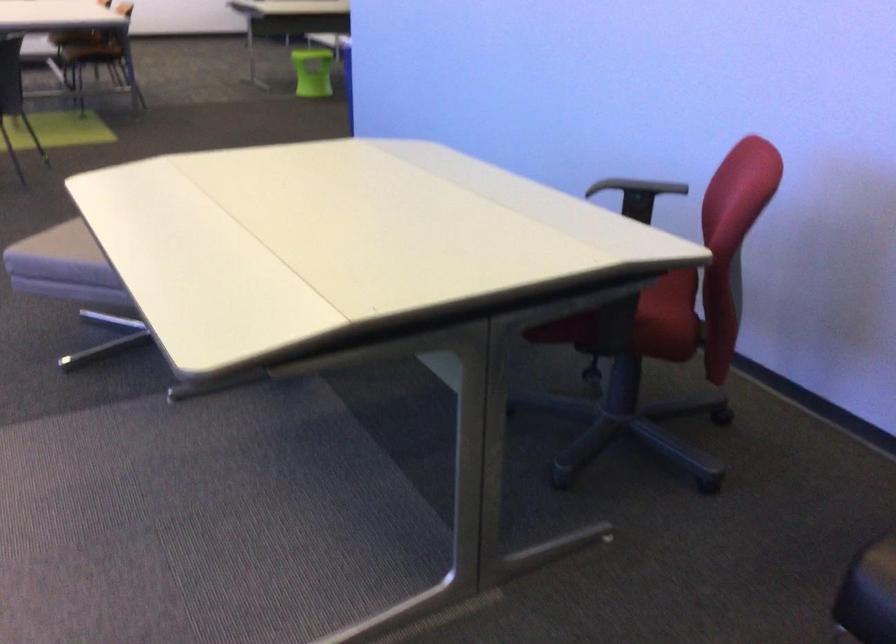
Locate an element on the screen. The image size is (896, 644). green plastic bin is located at coordinates (312, 71).